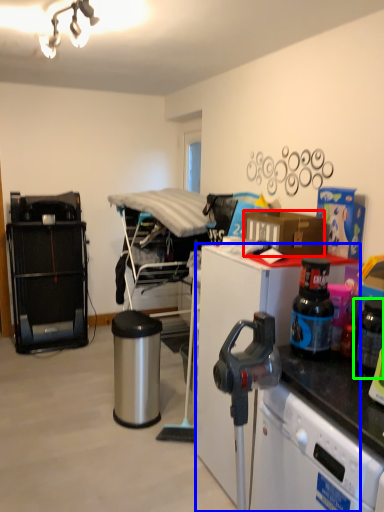
Question: Which is farther away from box (highlighted by a red box)? desk (highlighted by a blue box) or appliance (highlighted by a green box)?

Choices:
 (A) desk
 (B) appliance

Answer: (B)